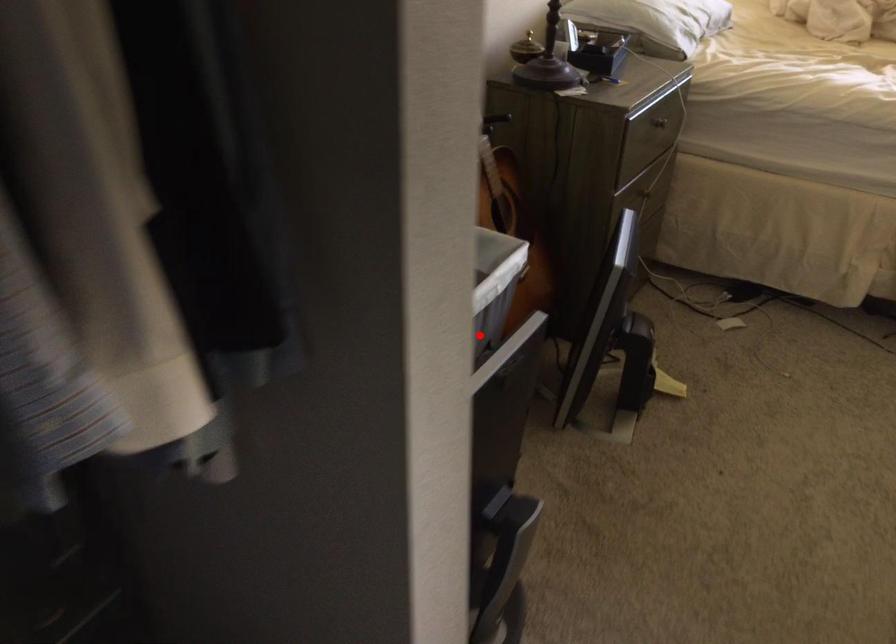
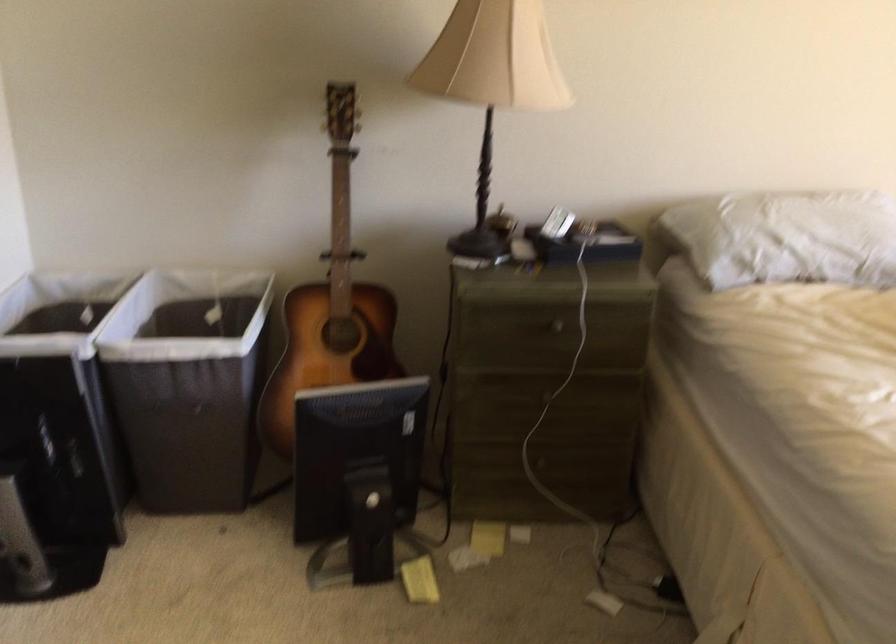
Question: I am providing you with two images of the same scene from different viewpoints. Given a red point in image1, look at the same physical point in image2. Is it:

Choices:
 (A) Closer to the viewpoint
 (B) Farther from the viewpoint

Answer: (B)